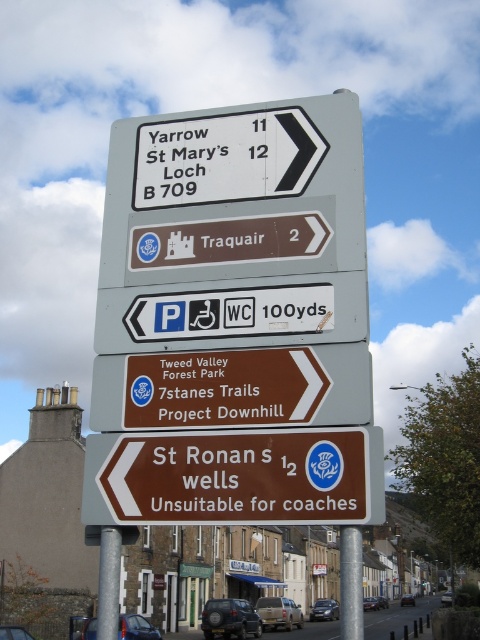
Which is more to the left, brownmaterial/texturesign at center or brown matte sign at center?

brown matte sign at center

The image size is (480, 640). I want to click on brownmaterial/texturesign at center, so click(x=236, y=477).

Where is `brownmaterial/texturesign at center`? This screenshot has height=640, width=480. brownmaterial/texturesign at center is located at coordinates (236, 477).